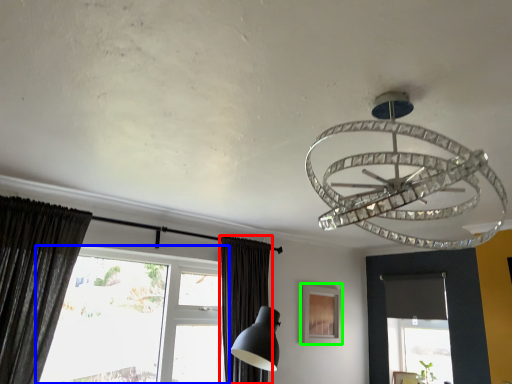
Question: Which object is positioned farthest from curtain (highlighted by a red box)? Select from window (highlighted by a blue box) and picture frame (highlighted by a green box).

Choices:
 (A) window
 (B) picture frame

Answer: (B)